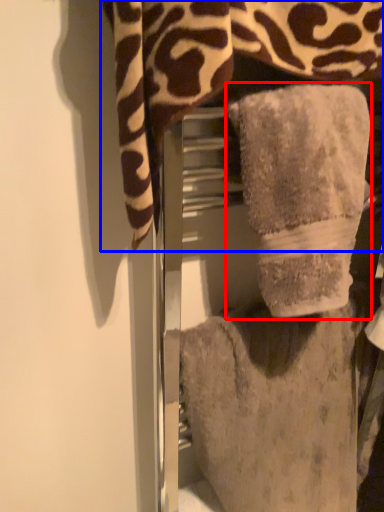
Question: Which point is further to the camera, towel (highlighted by a red box) or towel (highlighted by a blue box)?

Choices:
 (A) towel
 (B) towel

Answer: (A)